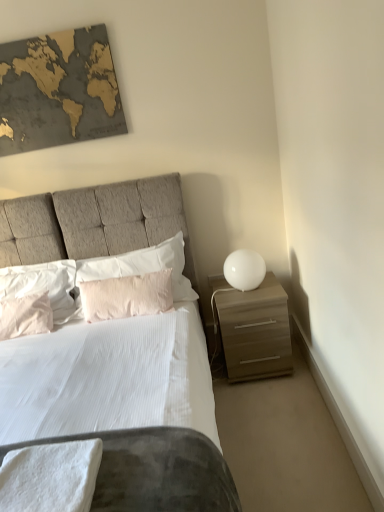
Identify the location of free space in front of matte brown nightstand at right. (264, 408).